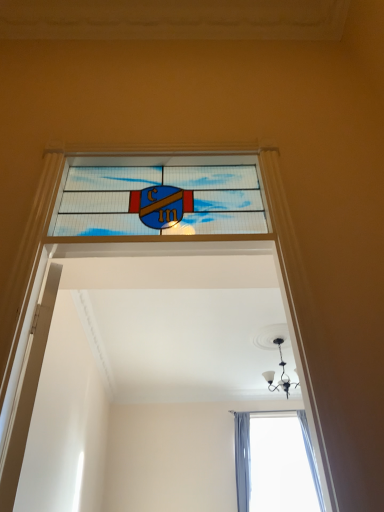
Question: Are white glossy door at left and stained glass window at center located far from each other?

Choices:
 (A) yes
 (B) no

Answer: (B)

Question: From the image's perspective, would you say white glossy door at left is shown under stained glass window at center?

Choices:
 (A) yes
 (B) no

Answer: (A)

Question: Is white glossy door at left to the right of stained glass window at center from the viewer's perspective?

Choices:
 (A) no
 (B) yes

Answer: (A)

Question: Is white glossy door at left at the left side of stained glass window at center?

Choices:
 (A) yes
 (B) no

Answer: (A)

Question: Would you say stained glass window at center is part of white glossy door at left's contents?

Choices:
 (A) no
 (B) yes

Answer: (A)

Question: In the image, is stained glass window at center positioned in front of or behind white glossy door at left?

Choices:
 (A) front
 (B) behind

Answer: (B)

Question: Is stained glass window at center to the left or to the right of white glossy door at left in the image?

Choices:
 (A) right
 (B) left

Answer: (A)

Question: Considering the positions of stained glass window at center and white glossy door at left in the image, is stained glass window at center wider or thinner than white glossy door at left?

Choices:
 (A) wide
 (B) thin

Answer: (A)

Question: From a real-world perspective, relative to white glossy door at left, is stained glass window at center vertically above or below?

Choices:
 (A) below
 (B) above

Answer: (B)

Question: Is white glossy door at left inside or outside of stained glass window at center?

Choices:
 (A) inside
 (B) outside

Answer: (B)

Question: In the image, is white glossy door at left on the left side or the right side of stained glass window at center?

Choices:
 (A) left
 (B) right

Answer: (A)

Question: In terms of height, does white glossy door at left look taller or shorter compared to stained glass window at center?

Choices:
 (A) tall
 (B) short

Answer: (A)

Question: From the image's perspective, relative to stained glass window at center, is white glossy door at left above or below?

Choices:
 (A) above
 (B) below

Answer: (B)

Question: Looking at the image, does black glass chandelier at upper center seem bigger or smaller compared to stained glass window at center?

Choices:
 (A) small
 (B) big

Answer: (B)

Question: Considering the positions of point (279, 355) and point (238, 180), is point (279, 355) closer or farther from the camera than point (238, 180)?

Choices:
 (A) farther
 (B) closer

Answer: (A)